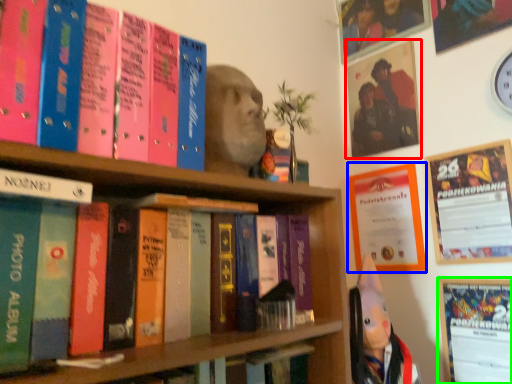
Question: Which object is positioned farthest from picture frame (highlighted by a red box)? Select from poster page (highlighted by a blue box) and bulletin board (highlighted by a green box).

Choices:
 (A) poster page
 (B) bulletin board

Answer: (B)